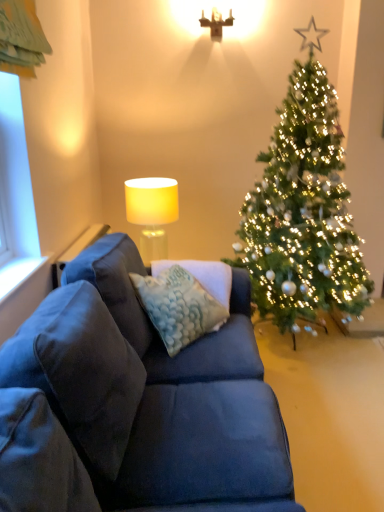
Question: Is green textured christmas tree at right completely or partially inside white fabric lampshade at upper center?

Choices:
 (A) no
 (B) yes

Answer: (A)

Question: From a real-world perspective, is white fabric lampshade at upper center on green textured christmas tree at right?

Choices:
 (A) yes
 (B) no

Answer: (B)

Question: Is white fabric lampshade at upper center shorter than green textured christmas tree at right?

Choices:
 (A) yes
 (B) no

Answer: (A)

Question: Is white fabric lampshade at upper center facing towards green textured christmas tree at right?

Choices:
 (A) no
 (B) yes

Answer: (A)

Question: Is white fabric lampshade at upper center further to camera compared to green textured christmas tree at right?

Choices:
 (A) yes
 (B) no

Answer: (A)

Question: From a real-world perspective, is white fabric lampshade at upper center under green textured christmas tree at right?

Choices:
 (A) yes
 (B) no

Answer: (A)

Question: Can matte white lampshade at upper center be found inside white painted wood at left?

Choices:
 (A) no
 (B) yes

Answer: (A)

Question: From the image's perspective, is white painted wood at left beneath matte white lampshade at upper center?

Choices:
 (A) yes
 (B) no

Answer: (A)

Question: Is white painted wood at left looking in the opposite direction of matte white lampshade at upper center?

Choices:
 (A) yes
 (B) no

Answer: (B)

Question: Does white painted wood at left have a larger size compared to matte white lampshade at upper center?

Choices:
 (A) no
 (B) yes

Answer: (A)

Question: Considering the relative positions of white painted wood at left and matte white lampshade at upper center in the image provided, is white painted wood at left behind matte white lampshade at upper center?

Choices:
 (A) no
 (B) yes

Answer: (A)

Question: Is white painted wood at left smaller than matte white lampshade at upper center?

Choices:
 (A) yes
 (B) no

Answer: (A)

Question: Does white painted wood at left have a lesser height compared to white fabric lampshade at upper center?

Choices:
 (A) no
 (B) yes

Answer: (B)